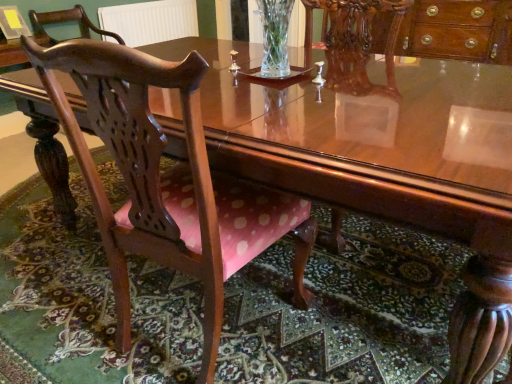
Question: From a real-world perspective, is polished wood chair at left, which ranks as the 2th chair in top-to-bottom order, located higher than white textured radiator at upper center?

Choices:
 (A) no
 (B) yes

Answer: (A)

Question: Considering the relative sizes of polished wood chair at left, placed as the 2th chair when sorted from left to right, and white textured radiator at upper center in the image provided, is polished wood chair at left, placed as the 2th chair when sorted from left to right, smaller than white textured radiator at upper center?

Choices:
 (A) no
 (B) yes

Answer: (A)

Question: Is polished wood chair at left, which ranks as the 2th chair in top-to-bottom order, in front of white textured radiator at upper center?

Choices:
 (A) no
 (B) yes

Answer: (B)

Question: Is polished wood chair at left, placed as the 2th chair when sorted from left to right, positioned with its back to white textured radiator at upper center?

Choices:
 (A) yes
 (B) no

Answer: (B)

Question: Is polished wood chair at left, which ranks as the 2th chair in top-to-bottom order, located outside white textured radiator at upper center?

Choices:
 (A) yes
 (B) no

Answer: (A)

Question: Can you confirm if polished wood chair at left, placed as the 2th chair when sorted from left to right, is taller than white textured radiator at upper center?

Choices:
 (A) no
 (B) yes

Answer: (B)

Question: From a real-world perspective, is polished wood chair at left, positioned as the first chair in left-to-right order, over white textured radiator at upper center?

Choices:
 (A) yes
 (B) no

Answer: (A)

Question: Is polished wood chair at left, which appears as the second chair when viewed from the right, oriented towards white textured radiator at upper center?

Choices:
 (A) yes
 (B) no

Answer: (B)

Question: Can you confirm if polished wood chair at left, which is the 1th chair in back-to-front order, is taller than white textured radiator at upper center?

Choices:
 (A) no
 (B) yes

Answer: (A)

Question: Can you confirm if polished wood chair at left, positioned as the first chair in left-to-right order, is thinner than white textured radiator at upper center?

Choices:
 (A) yes
 (B) no

Answer: (B)

Question: Is polished wood chair at left, which appears as the 1th chair when viewed from the top, located outside white textured radiator at upper center?

Choices:
 (A) no
 (B) yes

Answer: (B)

Question: From the image's perspective, is polished wood chair at left, marked as the second chair in a bottom-to-top arrangement, below white textured radiator at upper center?

Choices:
 (A) no
 (B) yes

Answer: (B)

Question: Does pink fabric chair at lower left have a lesser width compared to white textured radiator at upper center?

Choices:
 (A) no
 (B) yes

Answer: (A)